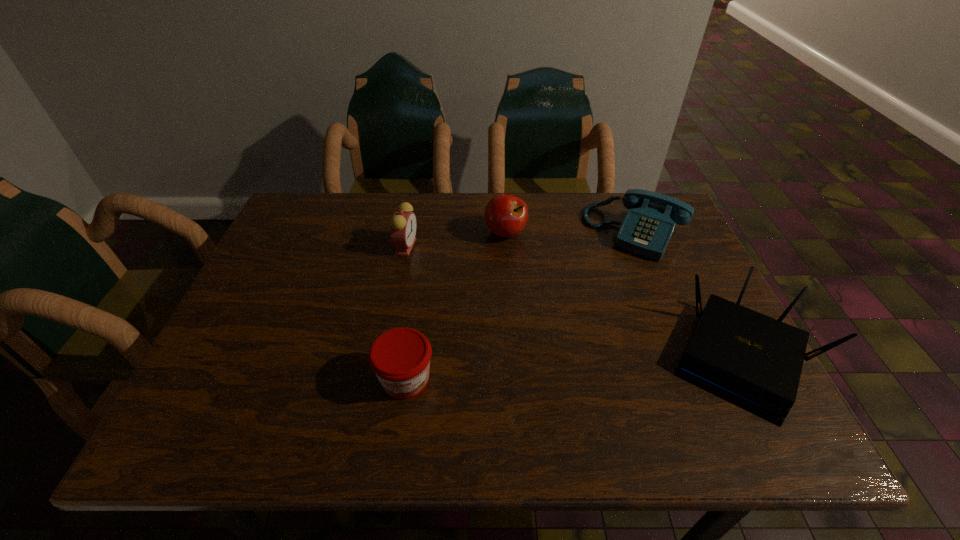
I want to click on router present at the right edge, so click(753, 361).

The image size is (960, 540). I want to click on telephone that is at the right edge, so click(x=646, y=230).

The height and width of the screenshot is (540, 960). In order to click on object situated at the far right corner in this screenshot , I will do `click(646, 230)`.

I want to click on object at the near right corner, so click(x=753, y=361).

Where is `free region at the far edge`? Image resolution: width=960 pixels, height=540 pixels. free region at the far edge is located at coordinates (543, 227).

At what (x,y) coordinates should I click in order to perform the action: click on blank space at the near edge. Please return your answer as a coordinate pair (x, y). Looking at the image, I should click on (678, 396).

In the image, there is a desktop. Where is `vacant space at the left edge`? The height and width of the screenshot is (540, 960). vacant space at the left edge is located at coordinates (247, 299).

You are a GUI agent. You are given a task and a screenshot of the screen. Output one action in this format:
    pyautogui.click(x=<x>, y=<y>)
    Task: Click on the vacant space at the right edge
    
    Given the screenshot: What is the action you would take?
    pyautogui.click(x=683, y=327)

I want to click on free spot at the far left corner of the desktop, so click(x=299, y=206).

The image size is (960, 540). Identify the location of empty location between the telephone and the alarm clock. pos(519,239).